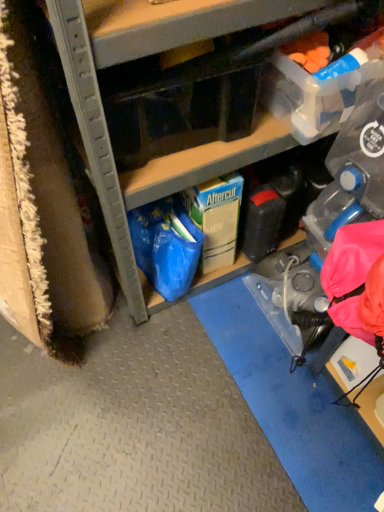
Question: Can matte cardboard box at center be found inside green cardboard box at center, the third storage box from the front?

Choices:
 (A) no
 (B) yes

Answer: (A)

Question: Is green cardboard box at center, the first storage box positioned from the back, positioned far away from matte cardboard box at center?

Choices:
 (A) no
 (B) yes

Answer: (A)

Question: Does green cardboard box at center, the third storage box from the front, have a smaller size compared to matte cardboard box at center?

Choices:
 (A) no
 (B) yes

Answer: (B)

Question: Is the depth of green cardboard box at center, the first storage box positioned from the back, greater than that of matte cardboard box at center?

Choices:
 (A) no
 (B) yes

Answer: (B)

Question: From the image's perspective, is green cardboard box at center, the third storage box from the front, on matte cardboard box at center?

Choices:
 (A) yes
 (B) no

Answer: (B)

Question: Is translucent plastic storage box at upper right, the 2th storage box when ordered from back to front, wider or thinner than transparent plastic storage box at upper center, the third storage box in the back-to-front sequence?

Choices:
 (A) wide
 (B) thin

Answer: (B)

Question: Do you think translucent plastic storage box at upper right, arranged as the second storage box when viewed from the front, is within transparent plastic storage box at upper center, the third storage box in the back-to-front sequence, or outside of it?

Choices:
 (A) inside
 (B) outside

Answer: (B)

Question: Is point (349, 76) closer or farther from the camera than point (109, 134)?

Choices:
 (A) closer
 (B) farther

Answer: (B)

Question: Is translucent plastic storage box at upper right, arranged as the second storage box when viewed from the front, to the left or to the right of transparent plastic storage box at upper center, the third storage box in the back-to-front sequence, in the image?

Choices:
 (A) right
 (B) left

Answer: (A)

Question: From a real-world perspective, relative to transparent plastic storage box at upper center, which is counted as the first storage box, starting from the front, is green cardboard box at center, the first storage box positioned from the back, vertically above or below?

Choices:
 (A) below
 (B) above

Answer: (A)

Question: Considering their positions, is green cardboard box at center, the third storage box from the front, located in front of or behind transparent plastic storage box at upper center, the third storage box in the back-to-front sequence?

Choices:
 (A) front
 (B) behind

Answer: (B)

Question: In terms of size, does green cardboard box at center, the first storage box positioned from the back, appear bigger or smaller than transparent plastic storage box at upper center, which is counted as the first storage box, starting from the front?

Choices:
 (A) small
 (B) big

Answer: (B)

Question: Which is correct: green cardboard box at center, the first storage box positioned from the back, is inside transparent plastic storage box at upper center, the third storage box in the back-to-front sequence, or outside of it?

Choices:
 (A) inside
 (B) outside

Answer: (B)

Question: In the image, is matte cardboard box at center on the left side or the right side of translucent plastic storage box at upper right, the 2th storage box when ordered from back to front?

Choices:
 (A) left
 (B) right

Answer: (A)

Question: From a real-world perspective, relative to translucent plastic storage box at upper right, arranged as the second storage box when viewed from the front, is matte cardboard box at center vertically above or below?

Choices:
 (A) below
 (B) above

Answer: (A)